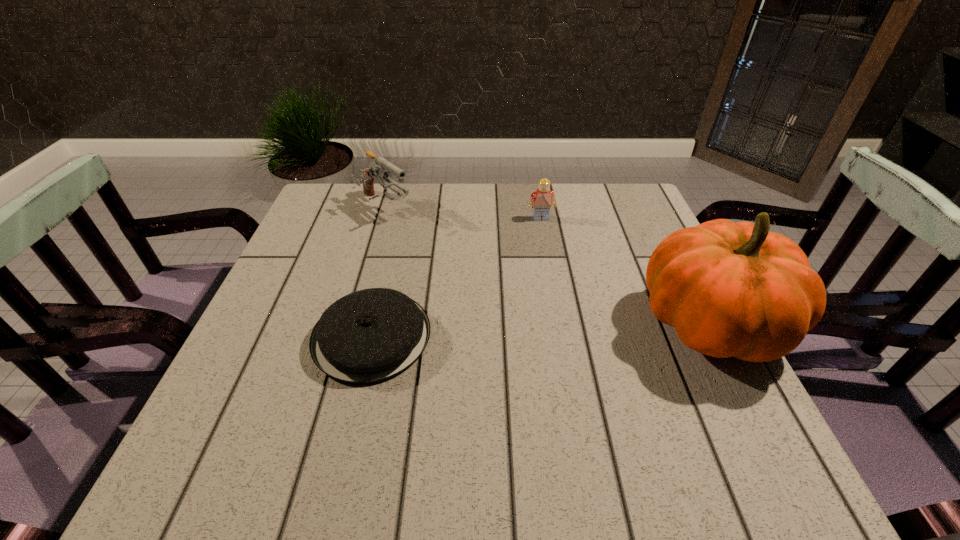
In the image, there is a desktop. In order to click on free space at the far right corner in this screenshot , I will do `click(649, 222)`.

Locate an element on the screen. blank space at the near right corner is located at coordinates pyautogui.click(x=696, y=381).

Find the location of a particular element. vacant area that lies between the Lego and the shortest object is located at coordinates (456, 277).

The image size is (960, 540). I want to click on unoccupied position between the rightmost object and the second object from right to left, so click(625, 271).

Locate an element on the screen. The height and width of the screenshot is (540, 960). vacant space in between the pumpkin and the second tallest object is located at coordinates (547, 267).

Image resolution: width=960 pixels, height=540 pixels. I want to click on free space between the shortest object and the second object from right to left, so click(x=456, y=277).

This screenshot has width=960, height=540. In order to click on free point between the second object from right to left and the gun in this screenshot , I will do `click(463, 213)`.

The width and height of the screenshot is (960, 540). In order to click on vacant point located between the Lego and the pancake in this screenshot , I will do `click(456, 277)`.

Identify the location of free point between the third object from left to right and the tallest object. This screenshot has height=540, width=960. (625, 271).

Locate an element on the screen. Image resolution: width=960 pixels, height=540 pixels. blank region between the pancake and the Lego is located at coordinates (456, 277).